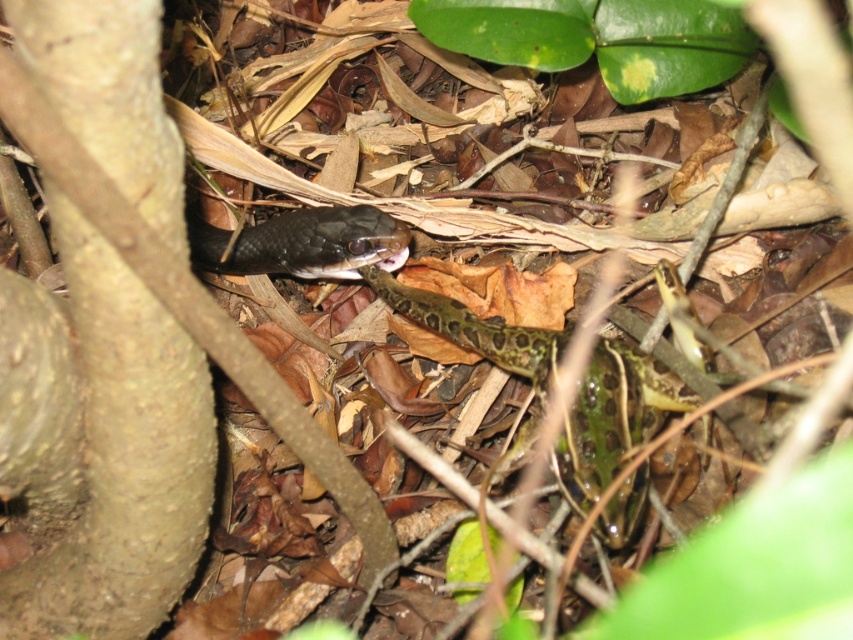
Question: In this image, where is smooth brown tree trunk at left located relative to shiny black snake at center?

Choices:
 (A) above
 (B) below

Answer: (B)

Question: Is green spotted python at center closer to camera compared to shiny black snake at center?

Choices:
 (A) no
 (B) yes

Answer: (B)

Question: Does smooth brown tree trunk at left appear on the right side of shiny black snake at center?

Choices:
 (A) no
 (B) yes

Answer: (B)

Question: Which point is closer to the camera?

Choices:
 (A) (332, 276)
 (B) (187, 580)

Answer: (B)

Question: Among these objects, which one is nearest to the camera?

Choices:
 (A) shiny black snake at center
 (B) green spotted python at center
 (C) smooth brown tree trunk at left

Answer: (C)

Question: Which of the following is the farthest from the observer?

Choices:
 (A) (474, 323)
 (B) (45, 22)

Answer: (A)